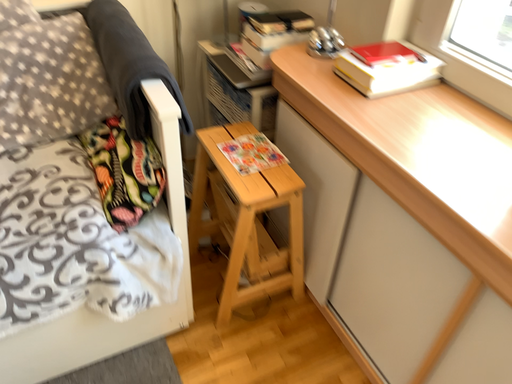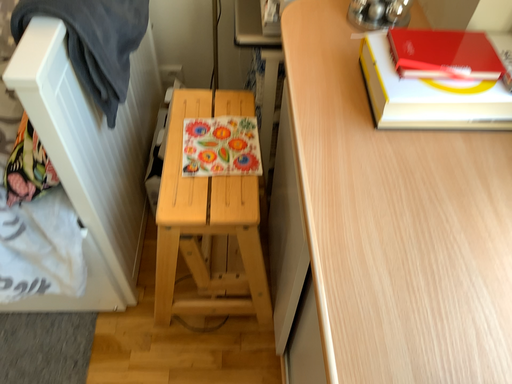
Question: How did the camera likely rotate when shooting the video?

Choices:
 (A) rotated downward
 (B) rotated upward

Answer: (A)